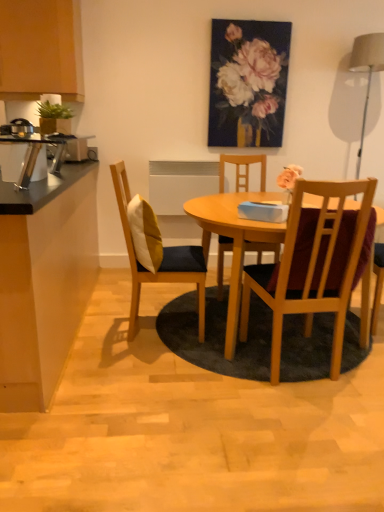
You are a GUI agent. You are given a task and a screenshot of the screen. Output one action in this format:
    pyautogui.click(x=<x>, y=<y>)
    Task: Click on the empty space that is ontop of pastel floral painting at upper center
    The image size is (384, 512).
    Given the screenshot: What is the action you would take?
    pyautogui.click(x=261, y=14)